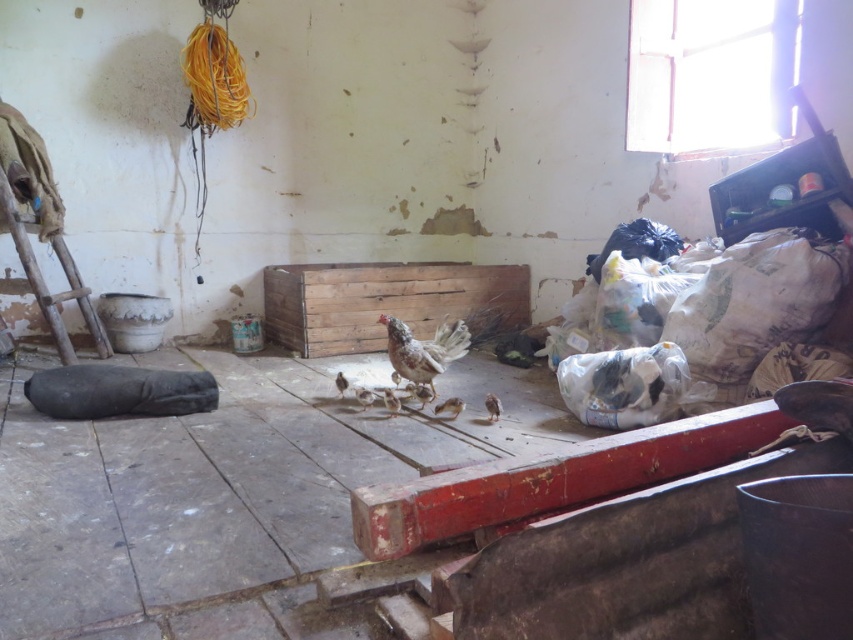
You are a farmer who needs to reach a tool stored on a high shelf in the barn. The wooden crate at center and the rusty wood ladder at left are available. Which object should you use to stand on to reach the shelf?

The wooden crate at center is 1.46 meters away from the rusty wood ladder at left. To reach the high shelf, you should use the rusty wood ladder at left because ladders are designed for climbing and reaching heights, whereas the wooden crate at center is meant for storage and may not be stable for standing.

You are a farmer entering the barn and need to retrieve a tool from the wooden crate at center. However, you must first climb the rusty wood ladder at left to reach a storage shelf. According to the scene, which object should you approach first to reach your goal?

You should approach the rusty wood ladder at left first because the wooden crate at center is to the right of it, meaning the ladder is closer to your starting position as you enter the barn.

You are a painter who needs to place a 1.2 meter wide canvas between the wooden crate at center and the rusty wood ladder at left. Based on their widths, will the space between them be sufficient?

The wooden crate at center might be wider than rusty wood ladder at left, so the total width required for the canvas placement is uncertain. It is recommended to measure the exact widths before deciding.